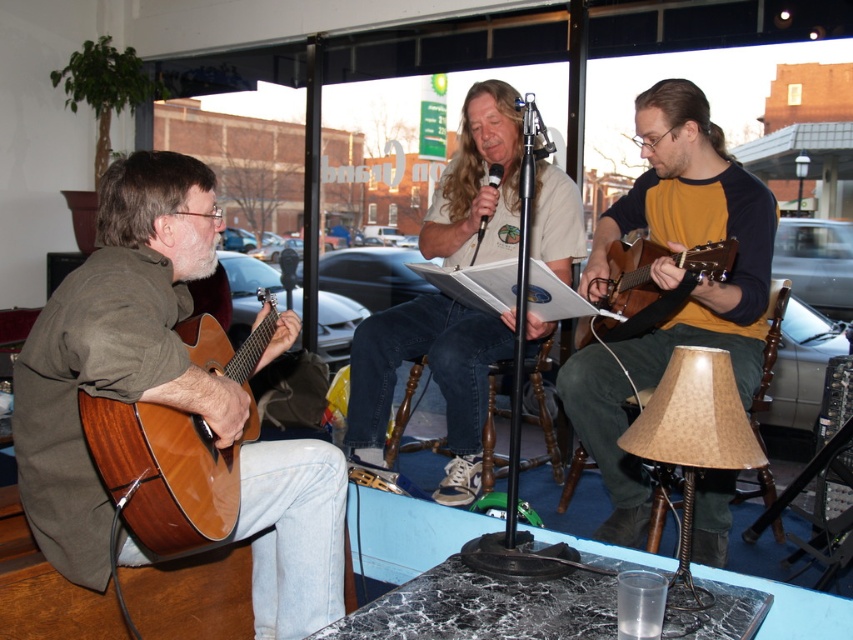
Is shiny brown acoustic guitar at left to the left of burlap lampshade at lower right from the viewer's perspective?

Indeed, shiny brown acoustic guitar at left is positioned on the left side of burlap lampshade at lower right.

Is shiny brown acoustic guitar at left shorter than burlap lampshade at lower right?

No, shiny brown acoustic guitar at left is not shorter than burlap lampshade at lower right.

I want to click on shiny brown acoustic guitar at left, so click(177, 445).

Consider the image. Who is lower down, matte brown guitar at center or shiny brown acoustic guitar at left?

shiny brown acoustic guitar at left is below.

Is matte brown guitar at center positioned before shiny brown acoustic guitar at left?

No, matte brown guitar at center is further to the viewer.

Between point (641, 212) and point (161, 444), which one is positioned in front?

Point (161, 444) is in front.

Find the location of a particular element. Image resolution: width=853 pixels, height=640 pixels. matte brown guitar at center is located at coordinates (689, 291).

Does matte brown guitar at center lie behind burlap lampshade at lower right?

Yes, it is behind burlap lampshade at lower right.

Consider the image. Does matte brown guitar at center appear over burlap lampshade at lower right?

Yes.

Measure the distance between matte brown guitar at center and camera.

The distance of matte brown guitar at center from camera is 2.13 meters.

The width and height of the screenshot is (853, 640). In order to click on matte brown guitar at center in this screenshot , I will do `click(689, 291)`.